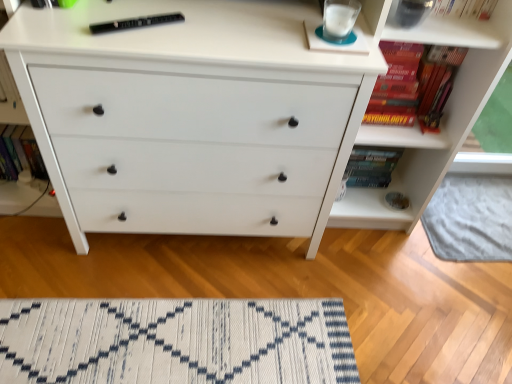
Question: In terms of size, does white textured rug at lower center appear bigger or smaller than hardcover book at upper right, acting as the 4th book starting from the left?

Choices:
 (A) small
 (B) big

Answer: (A)

Question: In the image, is white textured rug at lower center positioned in front of or behind hardcover book at upper right, acting as the 4th book starting from the left?

Choices:
 (A) front
 (B) behind

Answer: (B)

Question: Considering the real-world distances, which object is farthest from the white woven mat at lower center?

Choices:
 (A) white textured rug at lower center
 (B) hardcover book at upper right, arranged as the 3th book when viewed from the left
 (C) hardcover book at upper right, positioned as the 1th book in right-to-left order
 (D) hardcover book at left, marked as the 4th book in a right-to-left arrangement
 (E) white matte chest of drawers at center

Answer: (A)

Question: Which of these objects is positioned closest to the hardcover book at left, acting as the first book starting from the left?

Choices:
 (A) white textured rug at lower center
 (B) white woven mat at lower center
 (C) black plastic remote at upper center, the third book viewed from the right
 (D) white matte chest of drawers at center
 (E) hardcover book at upper right, acting as the 4th book starting from the left

Answer: (D)